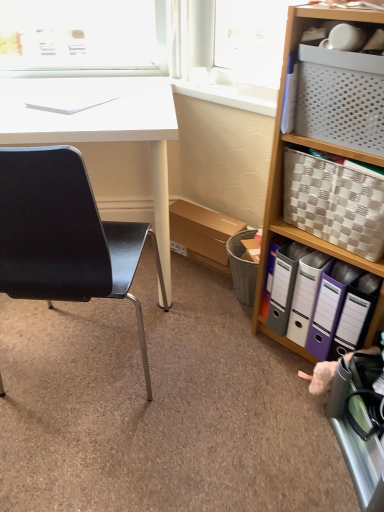
Question: From a real-world perspective, is checkered fabric picnic basket at right positioned above or below black matte chair at left?

Choices:
 (A) below
 (B) above

Answer: (B)

Question: Is checkered fabric picnic basket at right in front of or behind black matte chair at left in the image?

Choices:
 (A) front
 (B) behind

Answer: (B)

Question: Estimate the real-world distances between objects in this image. Which object is farther from the white woven basket at right?

Choices:
 (A) black matte chair at left
 (B) checkered fabric picnic basket at right
 (C) white plastic window sill at upper center
 (D) white glossy desk at left

Answer: (D)

Question: Which of these objects is positioned closest to the checkered fabric picnic basket at right?

Choices:
 (A) white glossy desk at left
 (B) black matte chair at left
 (C) white woven basket at right
 (D) white plastic window sill at upper center

Answer: (C)